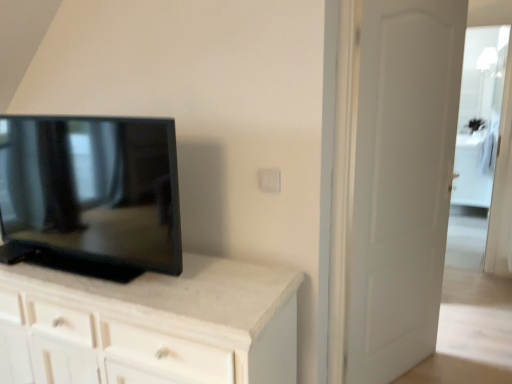
Question: Considering the relative positions of transparent glass door at right and white matte door at right in the image provided, is transparent glass door at right to the left of white matte door at right from the viewer's perspective?

Choices:
 (A) no
 (B) yes

Answer: (A)

Question: Is transparent glass door at right in front of white matte door at right?

Choices:
 (A) yes
 (B) no

Answer: (B)

Question: Is white matte door at right at the back of transparent glass door at right?

Choices:
 (A) yes
 (B) no

Answer: (B)

Question: Is the surface of transparent glass door at right in direct contact with white matte door at right?

Choices:
 (A) yes
 (B) no

Answer: (B)

Question: From the image's perspective, is transparent glass door at right below white matte door at right?

Choices:
 (A) yes
 (B) no

Answer: (B)

Question: From a real-world perspective, is transparent glass door at right positioned over white matte door at right based on gravity?

Choices:
 (A) yes
 (B) no

Answer: (A)

Question: Is white matte door at right oriented towards transparent glass door at right?

Choices:
 (A) no
 (B) yes

Answer: (A)

Question: From the image's perspective, is white matte door at right located beneath transparent glass door at right?

Choices:
 (A) yes
 (B) no

Answer: (A)

Question: Would you say white matte door at right is a long distance from transparent glass door at right?

Choices:
 (A) no
 (B) yes

Answer: (B)

Question: Can you confirm if white matte door at right is thinner than transparent glass door at right?

Choices:
 (A) yes
 (B) no

Answer: (B)

Question: Can you confirm if white matte door at right is smaller than transparent glass door at right?

Choices:
 (A) yes
 (B) no

Answer: (B)

Question: Is white matte door at right not within transparent glass door at right?

Choices:
 (A) no
 (B) yes

Answer: (B)

Question: Are transparent glass door at right and matte black tv at left far apart?

Choices:
 (A) yes
 (B) no

Answer: (A)